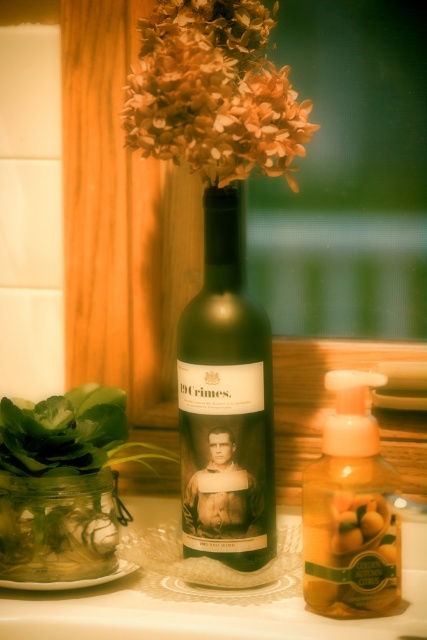
You are organizing a small shelf in your kitchen and need to place the green leafy plant at left and the clear glass jar at lower left. Which object requires more space due to its size?

The green leafy plant at left requires more space because it has a larger size compared to the clear glass jar at lower left.

You are arranging flowers in a vase and need to place the orange matte flowers at upper center and the yellow translucent soap dispenser at center. Based on the scene, which object is positioned closer to the front of the arrangement?

The orange matte flowers at upper center are positioned closer to the viewer than the yellow translucent soap dispenser at center, so they are at the front of the arrangement.